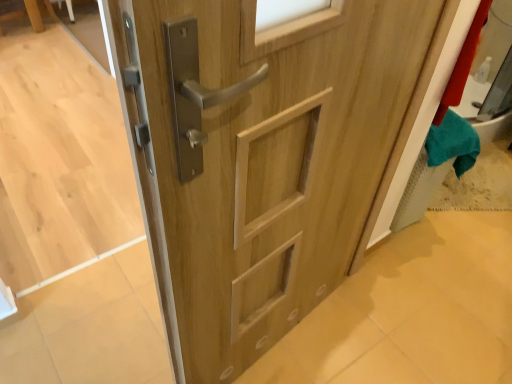
What are the coordinates of `natural wood door at center` in the screenshot? It's located at (261, 157).

Image resolution: width=512 pixels, height=384 pixels. What do you see at coordinates (261, 157) in the screenshot?
I see `natural wood door at center` at bounding box center [261, 157].

What is the approximate height of natural wood door at center?

The height of natural wood door at center is 1.19 meters.

Find the location of a particular element. natural wood door at center is located at coordinates (261, 157).